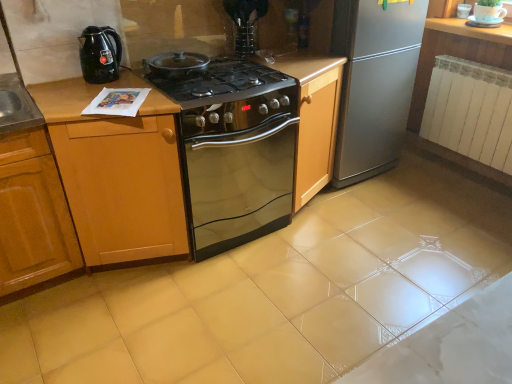
Question: From a real-world perspective, relative to wooden cabinet at left, which appears as the second cabinetry when viewed from the right, is wooden cabinet at center, the first cabinetry when ordered from right to left, vertically above or below?

Choices:
 (A) above
 (B) below

Answer: (A)

Question: Considering the positions of wooden cabinet at center, the second cabinetry when ordered from left to right, and wooden cabinet at left, which appears as the second cabinetry when viewed from the right, in the image, is wooden cabinet at center, the second cabinetry when ordered from left to right, wider or thinner than wooden cabinet at left, which appears as the second cabinetry when viewed from the right,?

Choices:
 (A) wide
 (B) thin

Answer: (B)

Question: Which object is positioned farthest from the wooden cabinet at center, the second cabinetry when ordered from left to right?

Choices:
 (A) stainless steel oven at center
 (B) black glossy electric kettle at left
 (C) clear glass vase at upper center, the 1th appliance when ordered from front to back
 (D) wooden cabinet at left, which appears as the second cabinetry when viewed from the right
 (E) silver metallic refrigerator at right

Answer: (E)

Question: Estimate the real-world distances between objects in this image. Which object is farther from the black glossy electric kettle at left?

Choices:
 (A) stainless steel oven at center
 (B) silver metallic refrigerator at right
 (C) wooden cabinet at left, which appears as the second cabinetry when viewed from the right
 (D) white wood countertop at upper right
 (E) white glossy cup at upper right, which is the 1th appliance from right to left

Answer: (E)